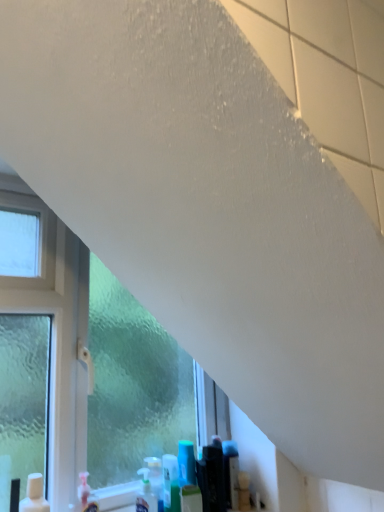
Question: Is translucent plastic spray bottle at lower center positioned before frosted glass window at left?

Choices:
 (A) no
 (B) yes

Answer: (A)

Question: Would you consider translucent plastic spray bottle at lower center to be distant from frosted glass window at left?

Choices:
 (A) yes
 (B) no

Answer: (B)

Question: Can you confirm if translucent plastic spray bottle at lower center is thinner than frosted glass window at left?

Choices:
 (A) no
 (B) yes

Answer: (B)

Question: From the image's perspective, is translucent plastic spray bottle at lower center on frosted glass window at left?

Choices:
 (A) yes
 (B) no

Answer: (B)

Question: Is translucent plastic spray bottle at lower center smaller than frosted glass window at left?

Choices:
 (A) no
 (B) yes

Answer: (B)

Question: Is translucent plastic spray bottle at lower center looking in the opposite direction of frosted glass window at left?

Choices:
 (A) yes
 (B) no

Answer: (A)

Question: Is frosted glass window at left at the right side of translucent plastic spray bottle at lower center?

Choices:
 (A) yes
 (B) no

Answer: (B)

Question: Is frosted glass window at left positioned beyond the bounds of translucent plastic spray bottle at lower center?

Choices:
 (A) yes
 (B) no

Answer: (A)

Question: Does frosted glass window at left have a larger size compared to translucent plastic spray bottle at lower center?

Choices:
 (A) no
 (B) yes

Answer: (B)

Question: Can you confirm if frosted glass window at left is shorter than translucent plastic spray bottle at lower center?

Choices:
 (A) no
 (B) yes

Answer: (A)

Question: Could you tell me if frosted glass window at left is turned towards translucent plastic spray bottle at lower center?

Choices:
 (A) no
 (B) yes

Answer: (B)

Question: From the image's perspective, is frosted glass window at left located above translucent plastic spray bottle at lower center?

Choices:
 (A) yes
 (B) no

Answer: (A)

Question: Do you think frosted glass window at left is within translucent plastic spray bottle at lower center, or outside of it?

Choices:
 (A) outside
 (B) inside

Answer: (A)